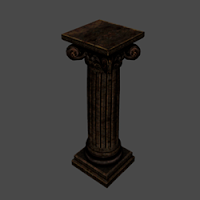
Where is `pedestal`? This screenshot has width=200, height=200. pedestal is located at coordinates (105, 35).